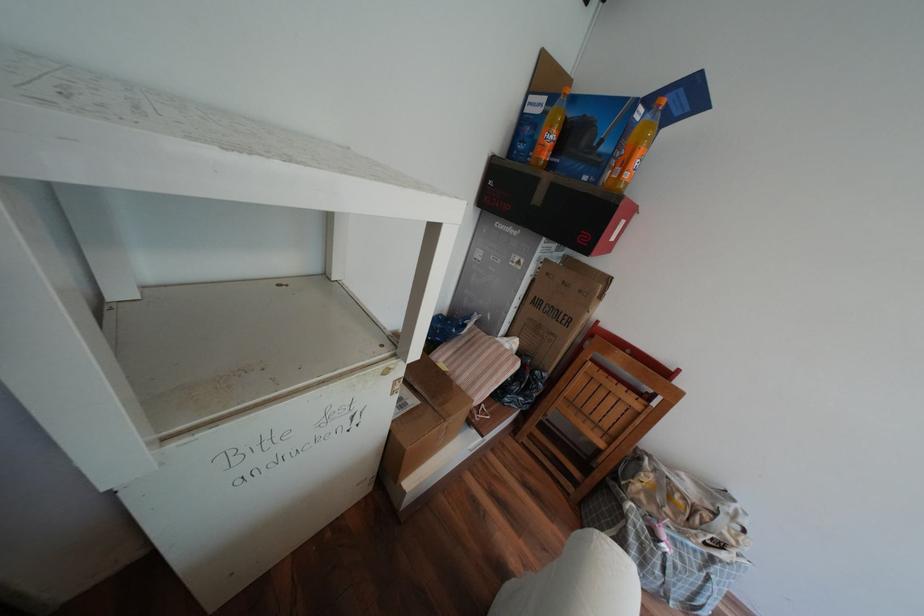
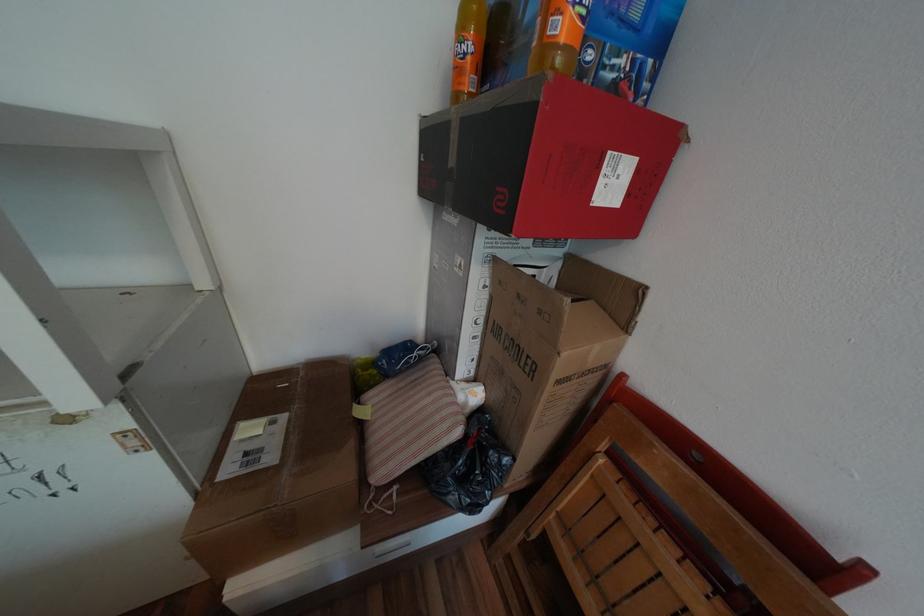
In the second image, find the point that corresponds to [561,127] in the first image.

(472, 31)